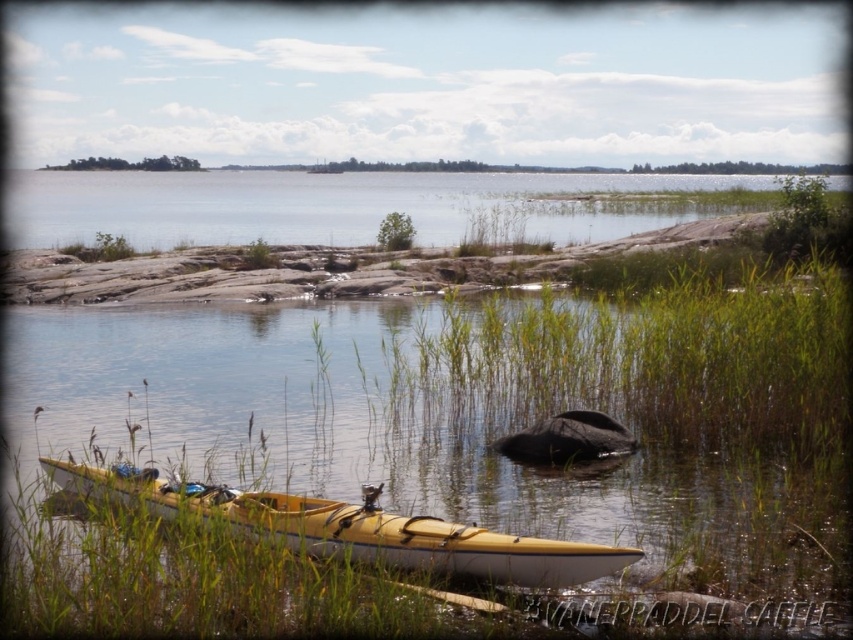
You are a photographer planning to capture the reflection of the clear water at center in your shot. Since the yellow matte kayak at lower left is in the way, can you adjust your position to still include both the reflection and the kayak in the frame?

The clear water at center is positioned over the yellow matte kayak at lower left, so you can adjust your angle to capture both the reflection of the clear water at center and the kayak by positioning yourself so that the kayak is partially beneath the reflective water area.

You are standing at the lakeside and want to take a photo of the green grass at lower center and the yellow matte kayak at lower left. Which object will appear larger in your photo?

The green grass at lower center will appear larger in the photo because it is bigger than the yellow matte kayak at lower left.

You are standing at the lakeside and want to place a 10 feet long fishing net between the green grass at lower center and the edge of the water. Is there enough space?

The green grass at lower center is 17.58 feet from the viewer. Since the fishing net is 10 feet long, there is sufficient space between the green grass at lower center and the water edge to place it.